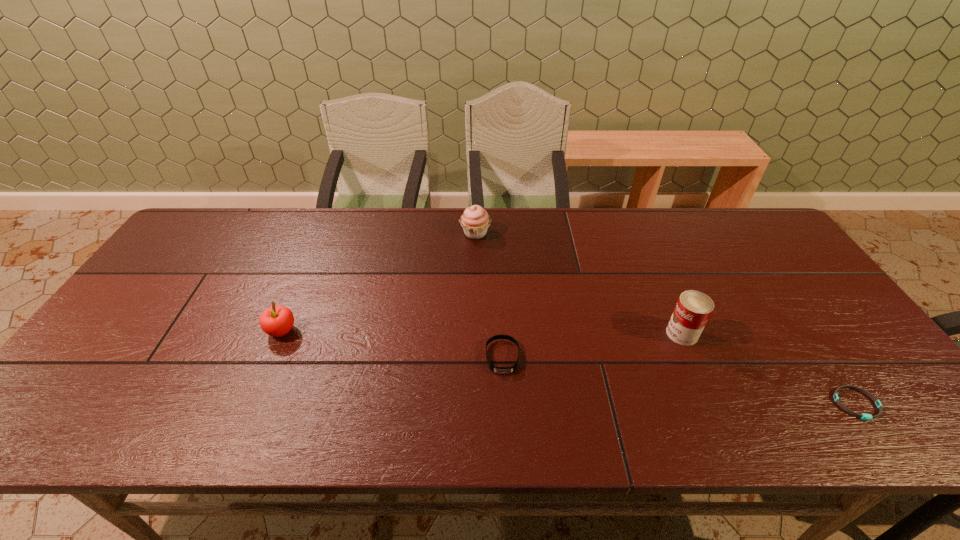
In the image, there is a desktop. At what (x,y) coordinates should I click in order to perform the action: click on vacant space at the far left corner. Please return your answer as a coordinate pair (x, y). Looking at the image, I should click on (204, 218).

Where is `free space at the far right corner of the desktop`? This screenshot has width=960, height=540. free space at the far right corner of the desktop is located at coordinates (721, 230).

Where is `free space between the rightmost object and the third tallest object`? This screenshot has height=540, width=960. free space between the rightmost object and the third tallest object is located at coordinates (569, 368).

Locate an element on the screen. unoccupied area between the left wristband and the third shortest object is located at coordinates (392, 344).

Where is `vacant point located between the shorter wristband and the fourth tallest object`? This screenshot has width=960, height=540. vacant point located between the shorter wristband and the fourth tallest object is located at coordinates (680, 381).

The image size is (960, 540). In order to click on free space that is in between the can and the right wristband in this screenshot , I will do `click(770, 369)`.

Locate an element on the screen. free space between the can and the cupcake is located at coordinates (579, 284).

The width and height of the screenshot is (960, 540). In order to click on empty space that is in between the left wristband and the rightmost object in this screenshot , I will do `click(680, 381)`.

The height and width of the screenshot is (540, 960). I want to click on blank region between the farther wristband and the shorter wristband, so coord(680,381).

The height and width of the screenshot is (540, 960). In order to click on free space between the cupcake and the leftmost object in this screenshot , I will do `click(378, 282)`.